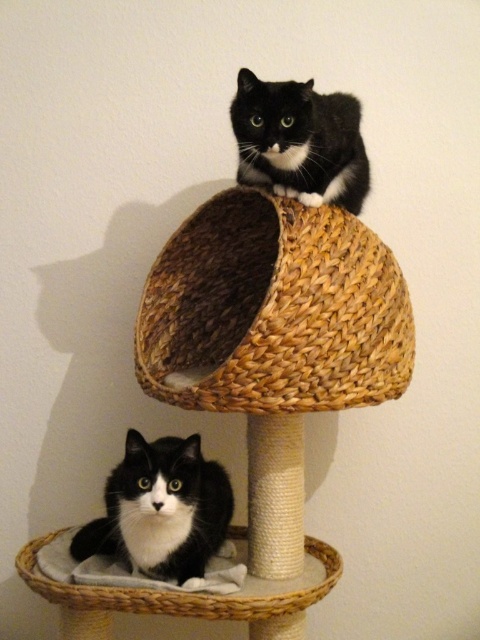
Question: Does woven straw basket at upper center appear on the left side of black matte fur cat at upper center?

Choices:
 (A) no
 (B) yes

Answer: (B)

Question: Which is farther from the woven straw basket at upper center?

Choices:
 (A) woven fabric cat bed at lower center
 (B) black and white fur cat at lower left
 (C) black matte fur cat at upper center

Answer: (A)

Question: Does woven straw basket at upper center appear over woven fabric cat bed at lower center?

Choices:
 (A) no
 (B) yes

Answer: (B)

Question: Is woven straw basket at upper center to the left of black matte fur cat at upper center from the viewer's perspective?

Choices:
 (A) no
 (B) yes

Answer: (B)

Question: Considering the real-world distances, which object is farthest from the woven straw basket at upper center?

Choices:
 (A) woven fabric cat bed at lower center
 (B) black and white fur cat at lower left
 (C) black matte fur cat at upper center

Answer: (A)

Question: Which point is closer to the camera taking this photo?

Choices:
 (A) (280, 112)
 (B) (212, 552)
 (C) (302, 573)
 (D) (297, 218)

Answer: (A)